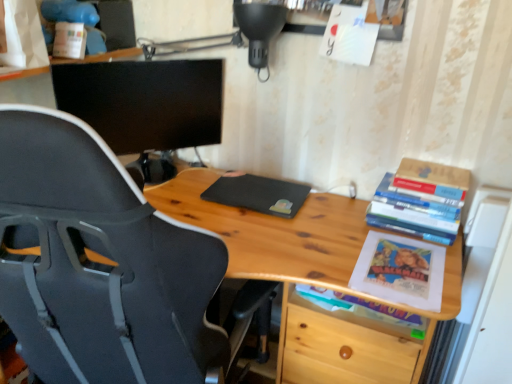
Where is `free region on the left part of hardcover books at right, which appears as the 2th book when viewed from the top`? The height and width of the screenshot is (384, 512). free region on the left part of hardcover books at right, which appears as the 2th book when viewed from the top is located at coordinates (347, 225).